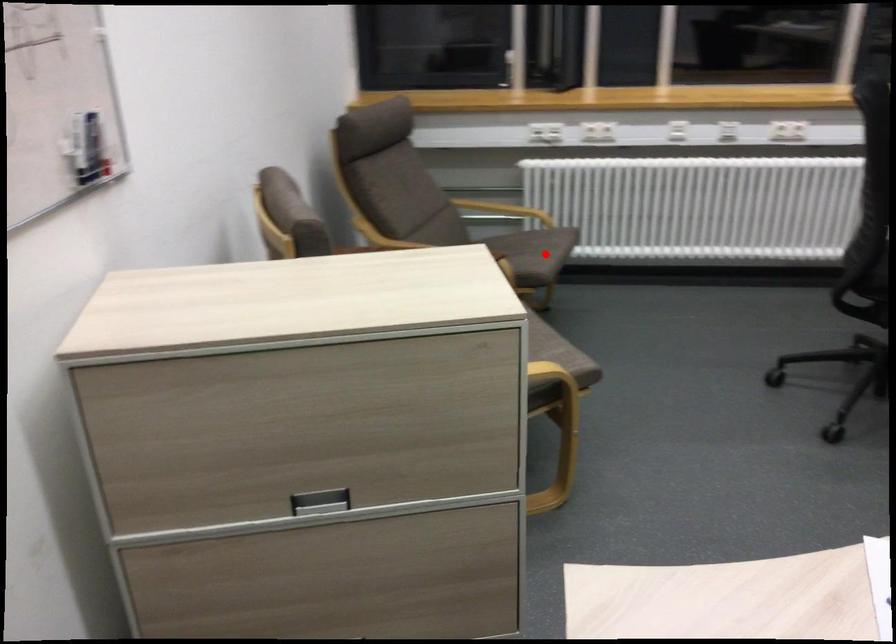
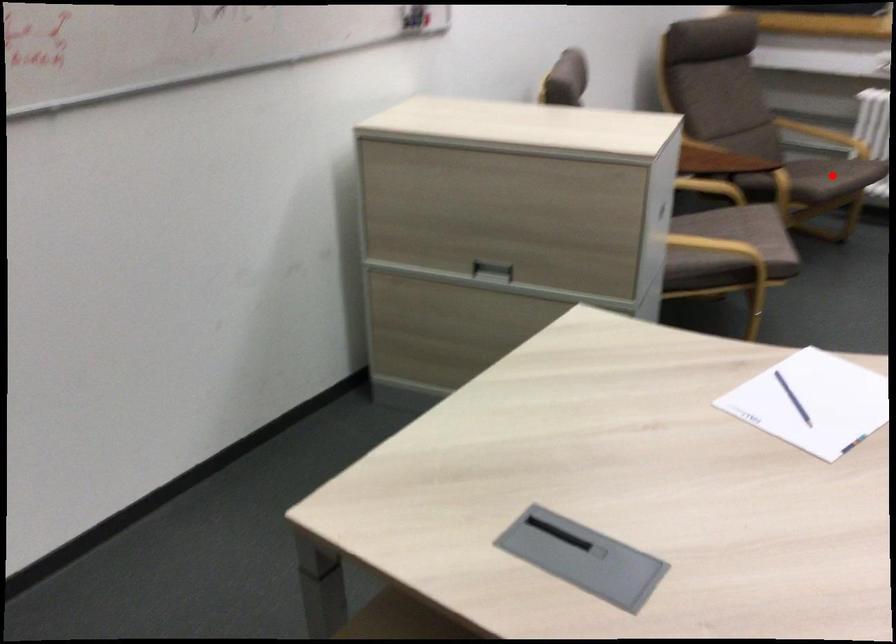
I am providing you with two images of the same scene from different viewpoints. A red point is marked on the first image and another point is marked on the second image. Does the point marked in image1 correspond to the same location as the one in image2?

Yes